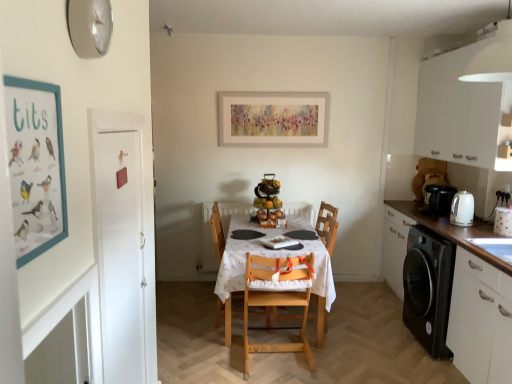
Identify the location of vacant area that is in front of wooden highchair at center. (335, 347).